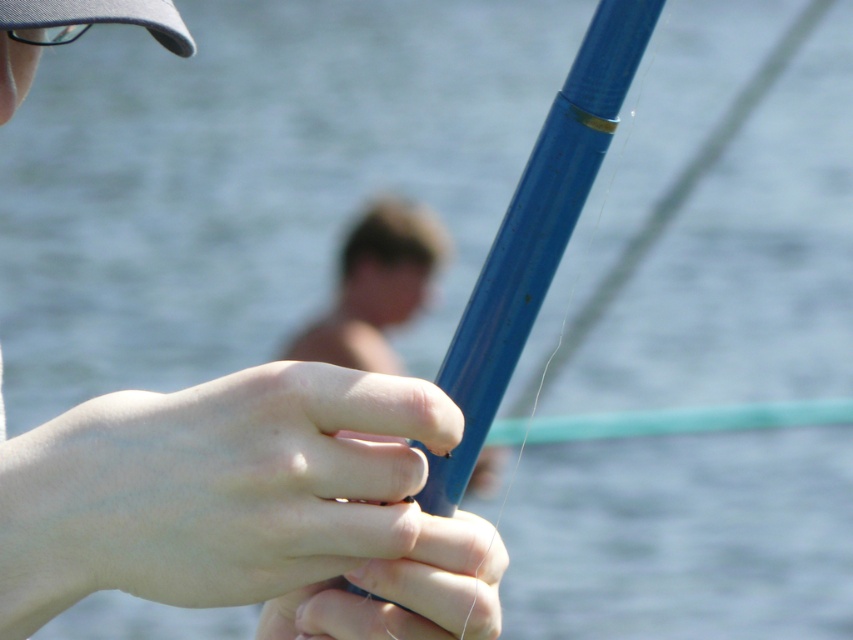
Question: Does blue plastic fishing pole at center appear over clear plastic goggles at upper left?

Choices:
 (A) yes
 (B) no

Answer: (B)

Question: Can you confirm if blue plastic fishing pole at center is bigger than matte gray baseball cap at upper left?

Choices:
 (A) yes
 (B) no

Answer: (A)

Question: Is smooth skin hand at center bigger than clear plastic goggles at upper left?

Choices:
 (A) no
 (B) yes

Answer: (B)

Question: Which point is closer to the camera taking this photo?

Choices:
 (A) 41,38
 (B) 292,593

Answer: (B)

Question: Which of the following is the closest to the observer?

Choices:
 (A) (485, 296)
 (B) (62, 26)
 (C) (115, 19)

Answer: (A)

Question: Which of the following is the closest to the observer?

Choices:
 (A) (165, 36)
 (B) (288, 563)
 (C) (44, 40)

Answer: (B)